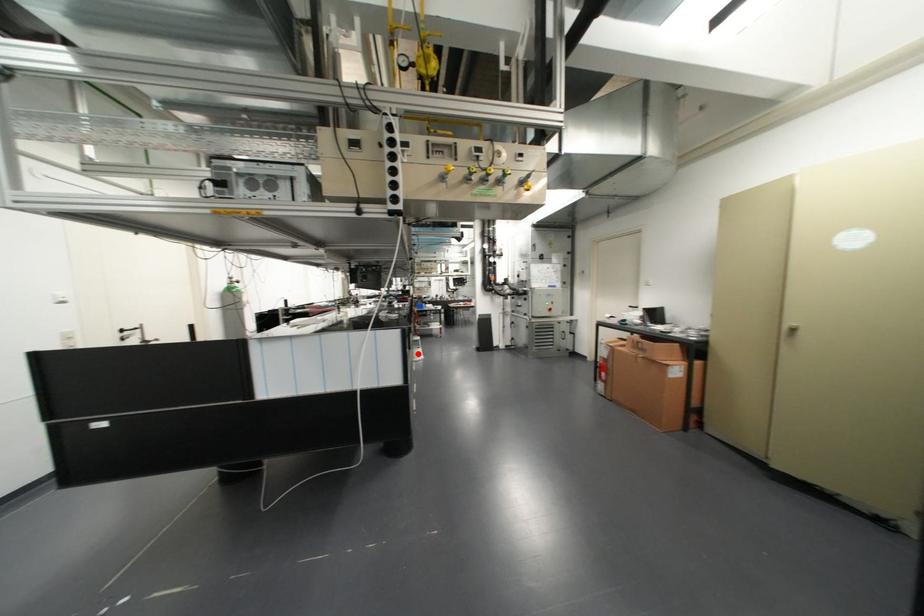
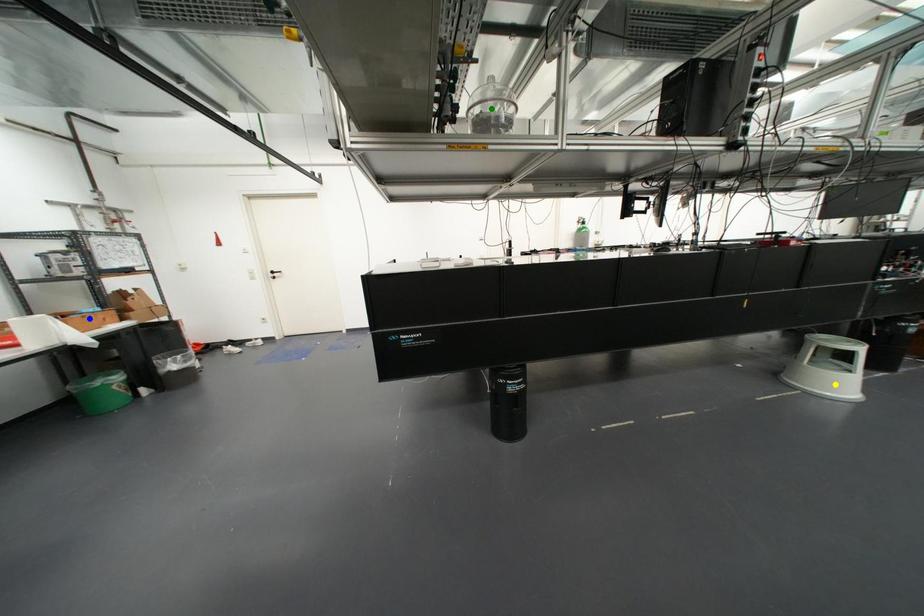
Question: I am providing you with two images of the same scene from different viewpoints. A red point is marked on the first image. You are given multiple points on the second image. Which point in image 2 represents the same 3d spot as the red point in image 1?

Choices:
 (A) green point
 (B) blue point
 (C) yellow point

Answer: (C)